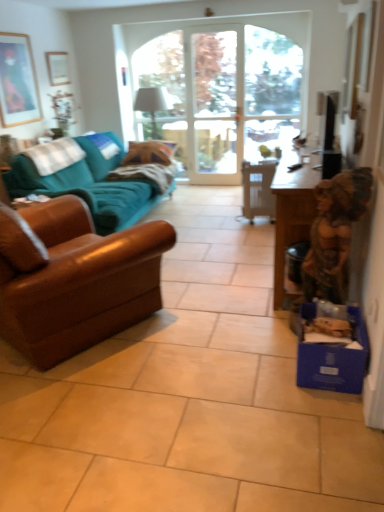
The height and width of the screenshot is (512, 384). What are the coordinates of `spots to the right of brown leather couch at left, the first studio couch in the front-to-back sequence` in the screenshot? It's located at [x=220, y=316].